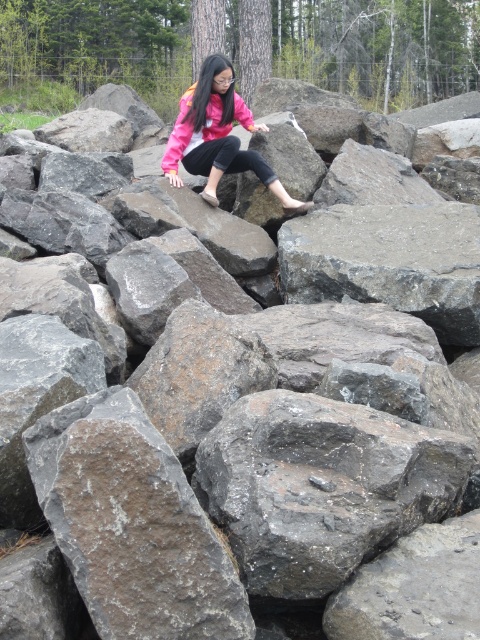
Where is `pink fleece jacket at center`? This screenshot has height=640, width=480. pink fleece jacket at center is located at coordinates (218, 136).

At what (x,y) coordinates should I click in order to perform the action: click on pink fleece jacket at center. Please return your answer as a coordinate pair (x, y). This screenshot has width=480, height=640. Looking at the image, I should click on (x=218, y=136).